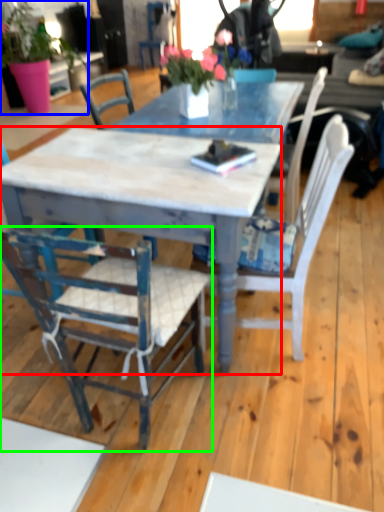
Question: Which is nearer to the desk (highlighted by a red box)? houseplant (highlighted by a blue box) or chair (highlighted by a green box).

Choices:
 (A) houseplant
 (B) chair

Answer: (B)